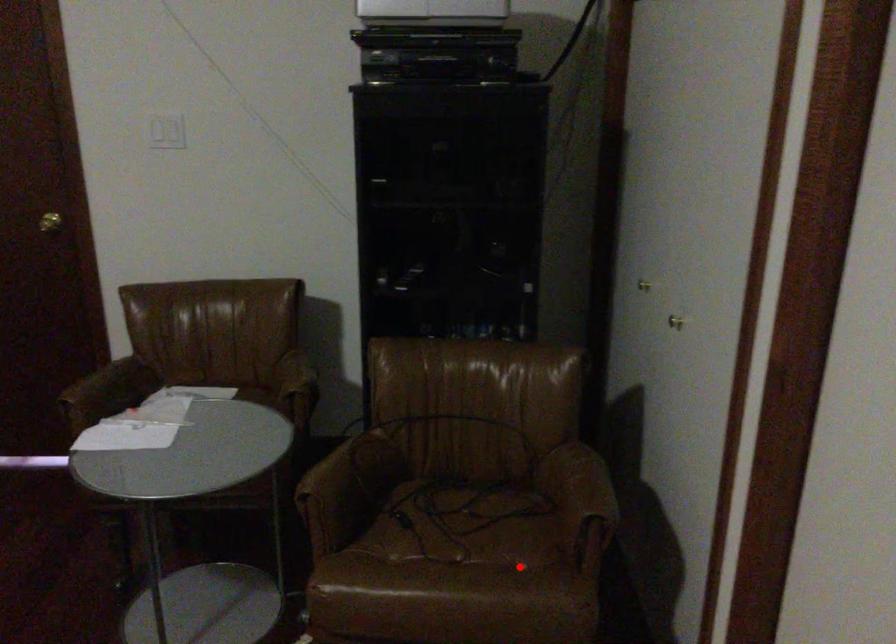
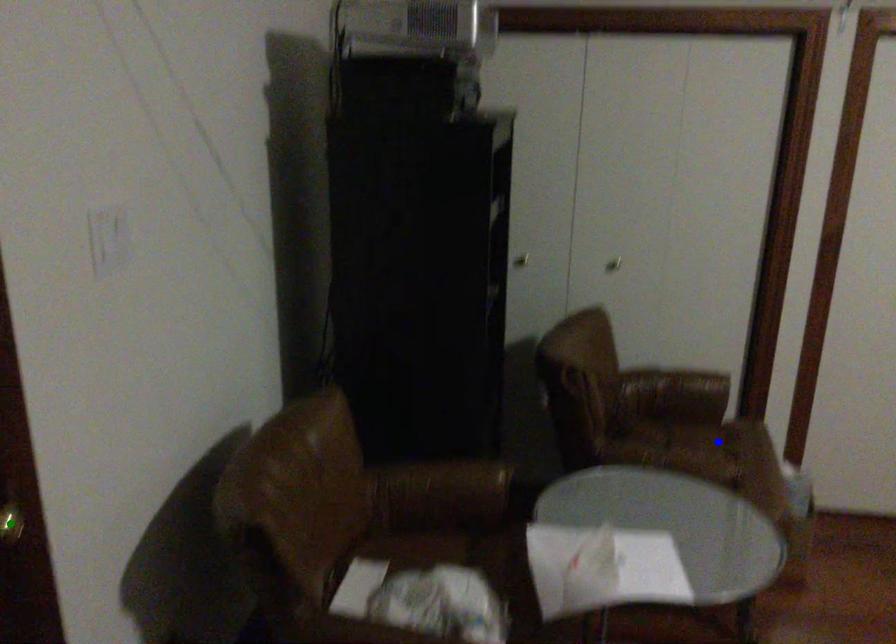
Question: I am providing you with two images of the same scene from different viewpoints. A red point is marked on the first image. You are given multiple points on the second image. Which mark in image 2 goes with the point in image 1?

Choices:
 (A) yellow point
 (B) green point
 (C) blue point

Answer: (C)